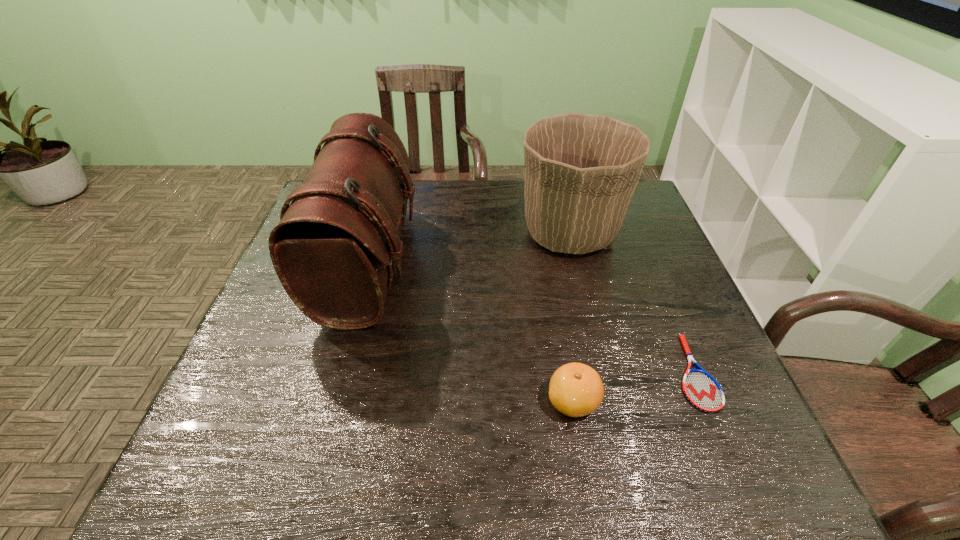
Locate an element on the screen. Image resolution: width=960 pixels, height=540 pixels. object that stands as the third closest to the satchel is located at coordinates (700, 388).

Point out which object is positioned as the second nearest to the second shortest object. Please provide its 2D coordinates. Your answer should be formatted as a tuple, i.e. [(x, y)], where the tuple contains the x and y coordinates of a point satisfying the conditions above.

[(334, 248)]

Where is `free space that satisfies the following two spatial constraints: 1. on the front-facing side of the third tallest object; 2. on the right side of the satchel`? Image resolution: width=960 pixels, height=540 pixels. free space that satisfies the following two spatial constraints: 1. on the front-facing side of the third tallest object; 2. on the right side of the satchel is located at coordinates (331, 401).

Identify the location of vacant space that satisfies the following two spatial constraints: 1. on the back side of the tennis racket; 2. on the right side of the third tallest object. The width and height of the screenshot is (960, 540). click(x=568, y=373).

You are a GUI agent. You are given a task and a screenshot of the screen. Output one action in this format:
    pyautogui.click(x=<x>, y=<y>)
    Task: Click on the blank space that satisfies the following two spatial constraints: 1. on the front-facing side of the leftmost object; 2. on the right side of the second shortest object
    
    Given the screenshot: What is the action you would take?
    pyautogui.click(x=331, y=401)

Where is `free space that satisfies the following two spatial constraints: 1. on the front-facing side of the leftmost object; 2. on the right side of the second shortest object`? The height and width of the screenshot is (540, 960). free space that satisfies the following two spatial constraints: 1. on the front-facing side of the leftmost object; 2. on the right side of the second shortest object is located at coordinates (331, 401).

This screenshot has width=960, height=540. I want to click on free location that satisfies the following two spatial constraints: 1. on the front-facing side of the shortest object; 2. on the right side of the leftmost object, so click(x=339, y=373).

What are the coordinates of `vacant position in the image that satisfies the following two spatial constraints: 1. on the front-facing side of the satchel; 2. on the left side of the clementine` in the screenshot? It's located at (331, 401).

The height and width of the screenshot is (540, 960). In order to click on free spot that satisfies the following two spatial constraints: 1. on the back side of the third tallest object; 2. on the front-facing side of the satchel in this screenshot , I will do `click(549, 264)`.